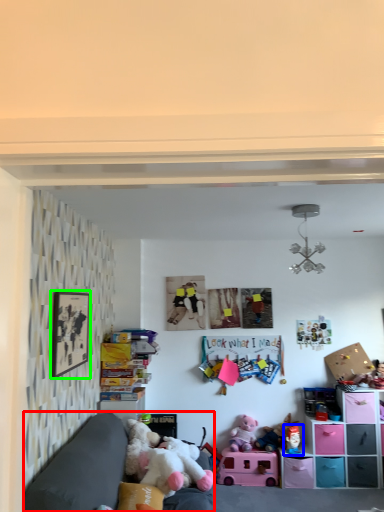
Question: Which is nearer to the studio couch (highlighted by a red box)? toy (highlighted by a blue box) or picture frame (highlighted by a green box).

Choices:
 (A) toy
 (B) picture frame

Answer: (B)